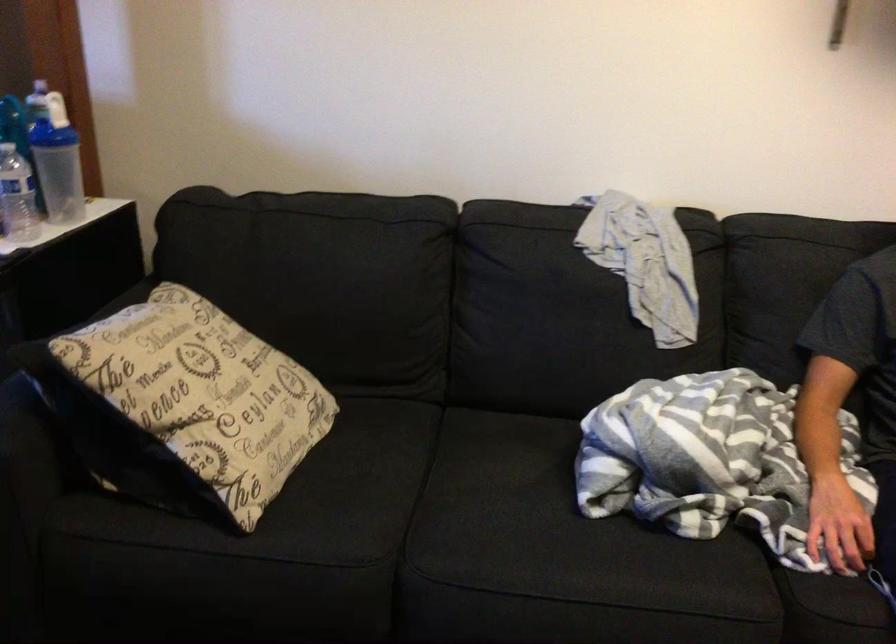
You are a GUI agent. You are given a task and a screenshot of the screen. Output one action in this format:
    pyautogui.click(x=<x>, y=<y>)
    Task: Click on the blue shaker bottle
    This screenshot has width=896, height=644.
    Given the screenshot: What is the action you would take?
    pyautogui.click(x=56, y=161)